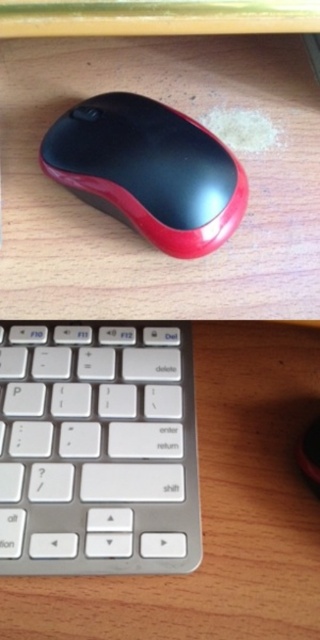
Who is lower down, white plastic keyboard at center or rubberized glossy mouse at center?

white plastic keyboard at center is below.

Between white plastic keyboard at center and rubberized glossy mouse at center, which one appears on the left side from the viewer's perspective?

white plastic keyboard at center

Does point (171, 433) lie behind point (179, 180)?

Yes, it is behind point (179, 180).

At what (x,y) coordinates should I click in order to perform the action: click on white plastic keyboard at center. Please return your answer as a coordinate pair (x, y). Looking at the image, I should click on (97, 449).